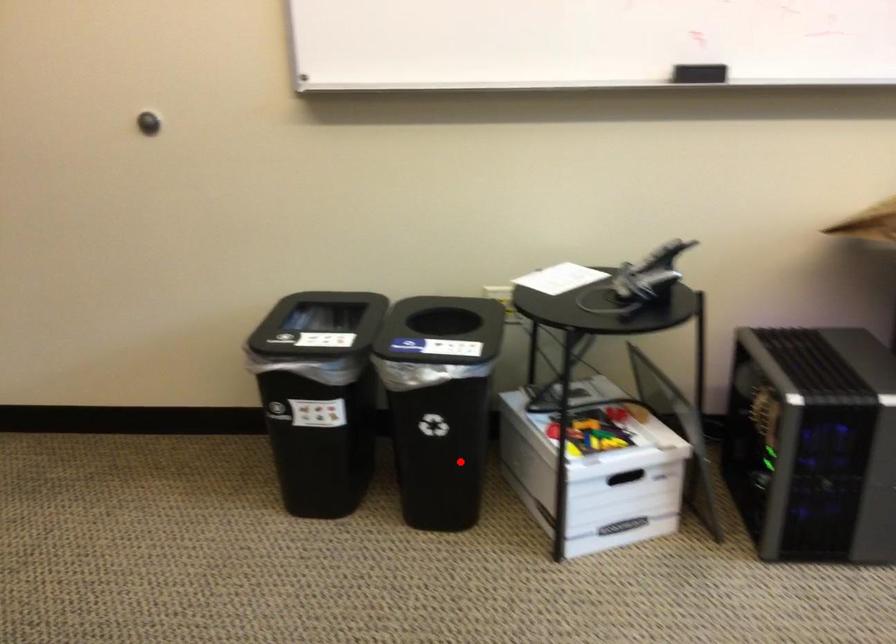
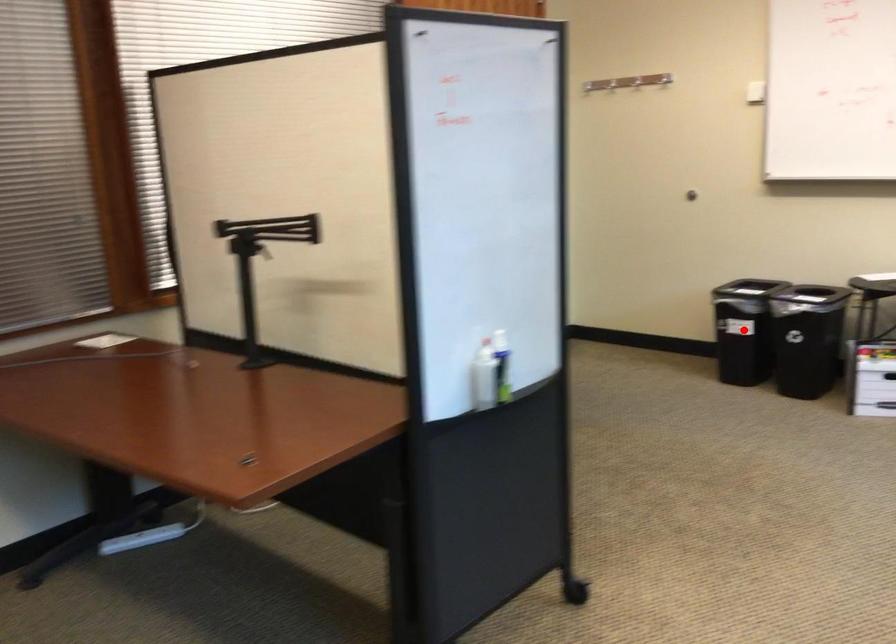
I am providing you with two images of the same scene from different viewpoints. A red point is marked on the first image and another point is marked on the second image. Do the highlighted points in image1 and image2 indicate the same real-world spot?

Yes